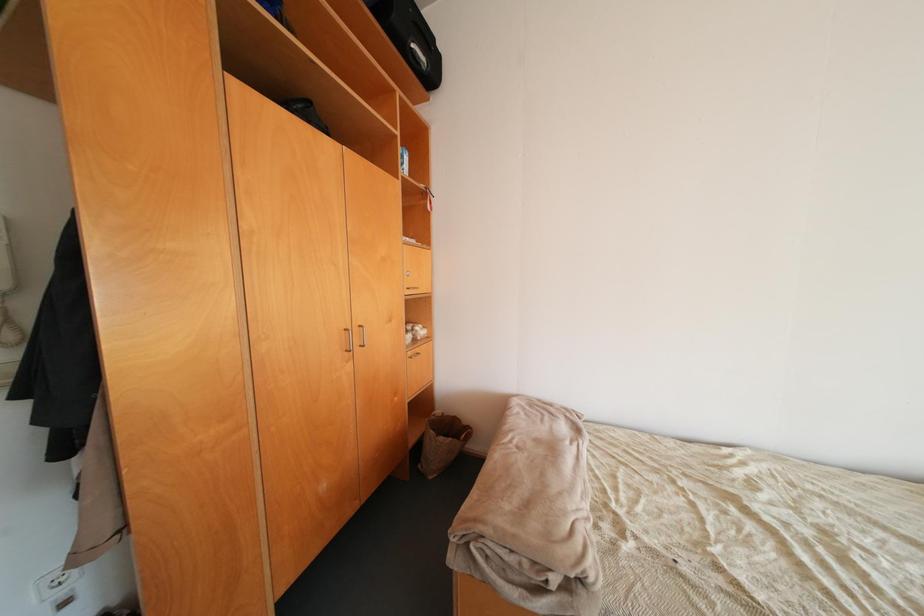
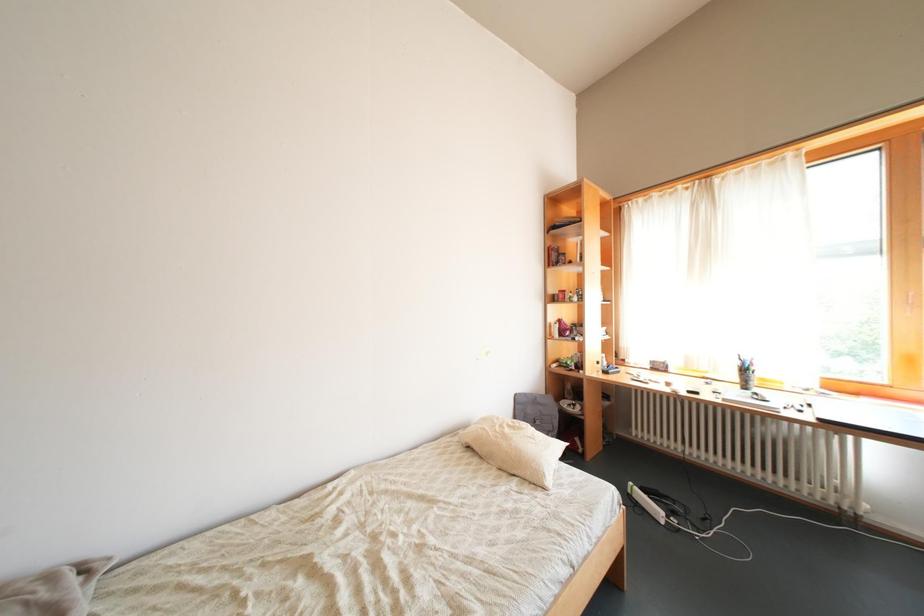
Question: The camera is either moving clockwise (left) or counter-clockwise (right) around the object. The first image is from the beginning of the video and the second image is from the end. Is the camera moving left or right when shooting the video?

Choices:
 (A) Left
 (B) Right

Answer: (A)